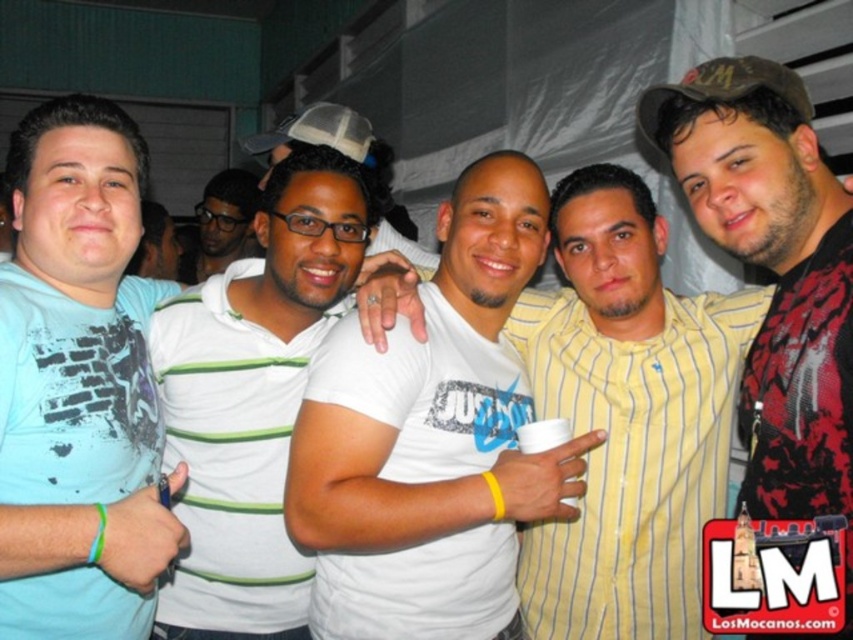
Question: Does light blue t-shirt at left have a lesser width compared to brown fabric baseball cap at upper right?

Choices:
 (A) no
 (B) yes

Answer: (A)

Question: Does white cotton t-shirt at center appear under white striped shirt at center?

Choices:
 (A) yes
 (B) no

Answer: (A)

Question: Does white striped shirt at center have a smaller size compared to dark red textured shirt at center?

Choices:
 (A) no
 (B) yes

Answer: (B)

Question: Estimate the real-world distances between objects in this image. Which object is closer to the light blue t-shirt at left?

Choices:
 (A) white cotton t-shirt at center
 (B) yellow striped shirt at center
 (C) white striped shirt at center

Answer: (C)

Question: Which object is closer to the camera taking this photo?

Choices:
 (A) light blue t-shirt at left
 (B) white striped shirt at center

Answer: (A)

Question: Among these points, which one is farthest from the camera?

Choices:
 (A) (268, 196)
 (B) (107, 189)
 (C) (213, 236)

Answer: (C)